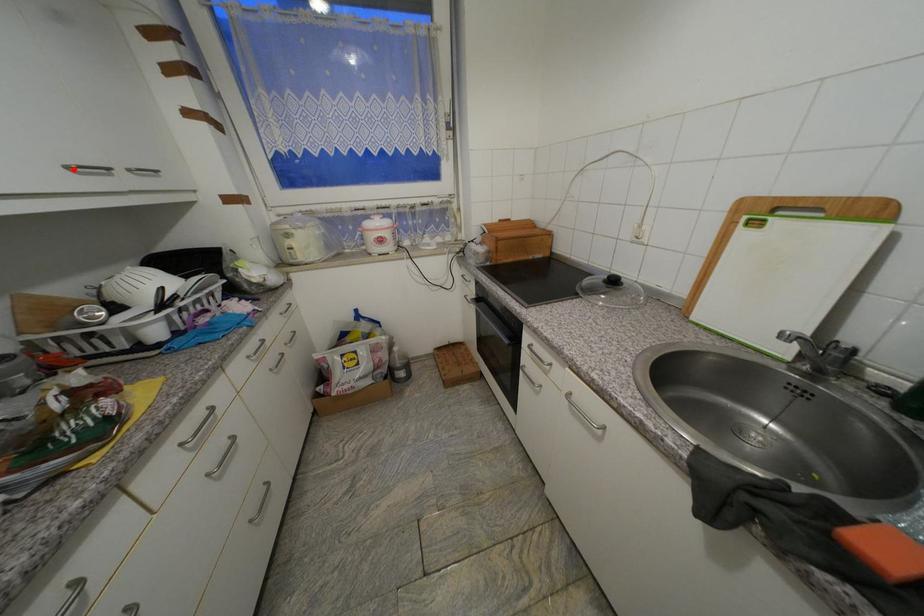
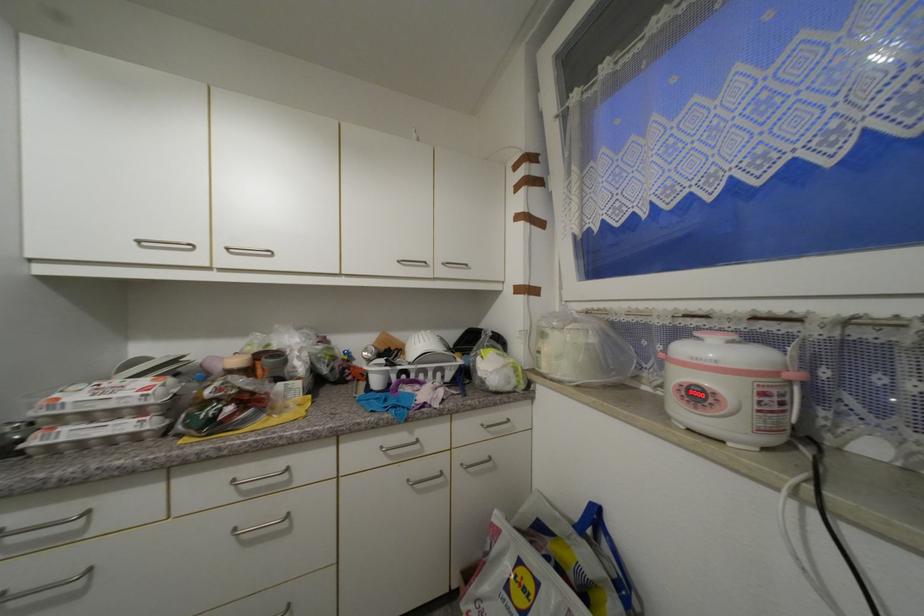
Where in the second image is the point corresponding to the highlighted location from the first image?

(405, 262)